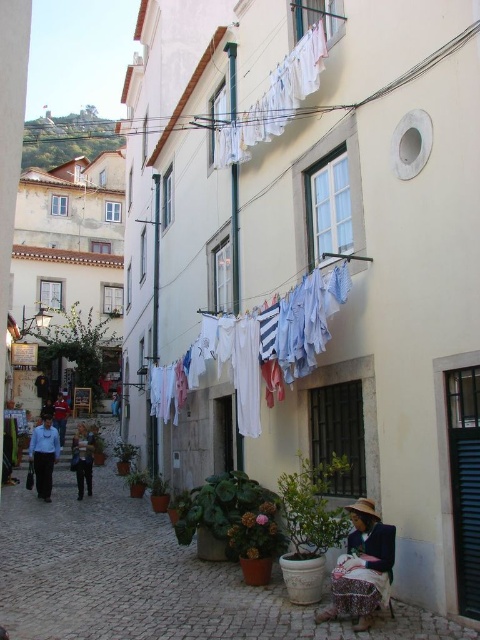
Question: Is plaid fabric skirt at lower right behind red fabric jacket at left?

Choices:
 (A) no
 (B) yes

Answer: (A)

Question: Can you confirm if white fabric at center is positioned below plaid fabric skirt at lower right?

Choices:
 (A) no
 (B) yes

Answer: (A)

Question: Which point is closer to the camera taking this photo?

Choices:
 (A) (88, 435)
 (B) (224, 131)
 (C) (319, 612)

Answer: (C)

Question: From the image, what is the correct spatial relationship of white fabric at center in relation to white fabric clothesline at upper center?

Choices:
 (A) right
 (B) left

Answer: (B)

Question: Among these points, which one is farthest from the camera?

Choices:
 (A) (317, 28)
 (B) (267, 614)
 (C) (348, 612)
 (D) (91, 467)

Answer: (D)

Question: Among these points, which one is farthest from the camera?

Choices:
 (A) (75, 449)
 (B) (215, 593)

Answer: (A)